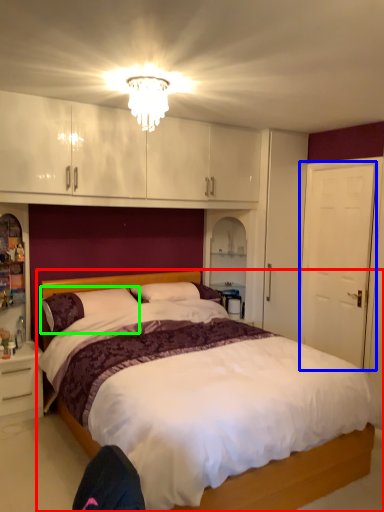
Question: Estimate the real-world distances between objects in this image. Which object is farther from bed (highlighted by a red box), door (highlighted by a blue box) or pillow (highlighted by a green box)?

Choices:
 (A) door
 (B) pillow

Answer: (B)